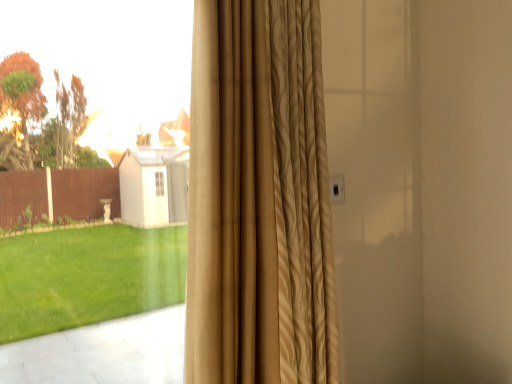
Describe the element at coordinates (259, 198) in the screenshot. Image resolution: width=512 pixels, height=384 pixels. I see `satin gold curtain at center` at that location.

Locate an element on the screen. This screenshot has width=512, height=384. satin gold curtain at center is located at coordinates (259, 198).

Measure the distance between point [241,306] and camera.

1.16 meters.

This screenshot has height=384, width=512. I want to click on satin gold curtain at center, so pyautogui.click(x=259, y=198).